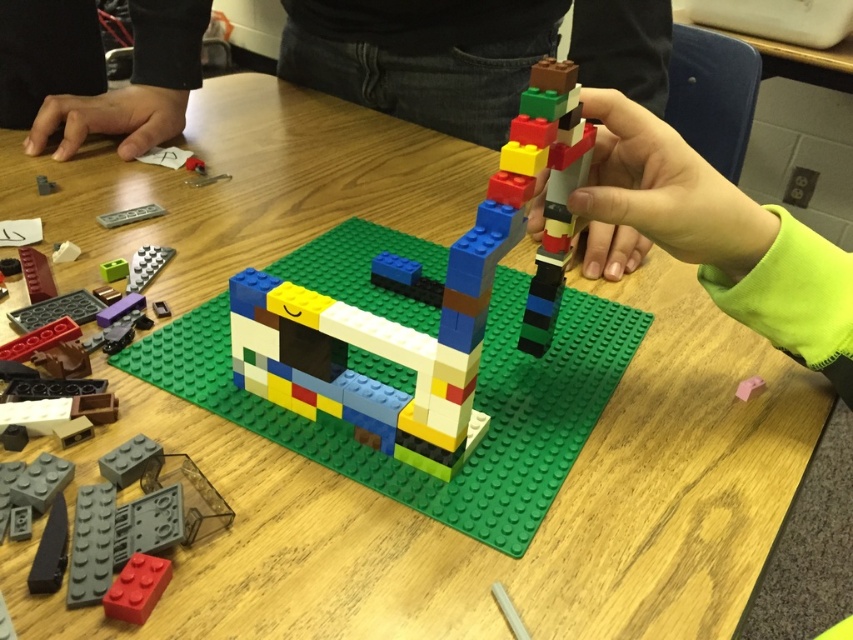
You are organizing a LEGO building session and need to place a pink rubber eraser at center to the right of the multicolored plastic blocks at center. Is the current arrangement already correct?

The multicolored plastic blocks at center is positioned on the left side of pink rubber eraser at center, so the current arrangement is correct as the eraser is already to the right of the blocks.

What is the object located at the coordinates point (720, 236)?

The point (720, 236) indicates a smooth plastic hand at center right.

You are a LEGO construction worker trying to place a new brick on the multicolored plastic blocks at center and the black fabric hand at upper left. Which object is taller so you can decide where to place the brick first?

The multicolored plastic blocks at center is taller than the black fabric hand at upper left, so you should place the brick on the multicolored plastic blocks at center first.